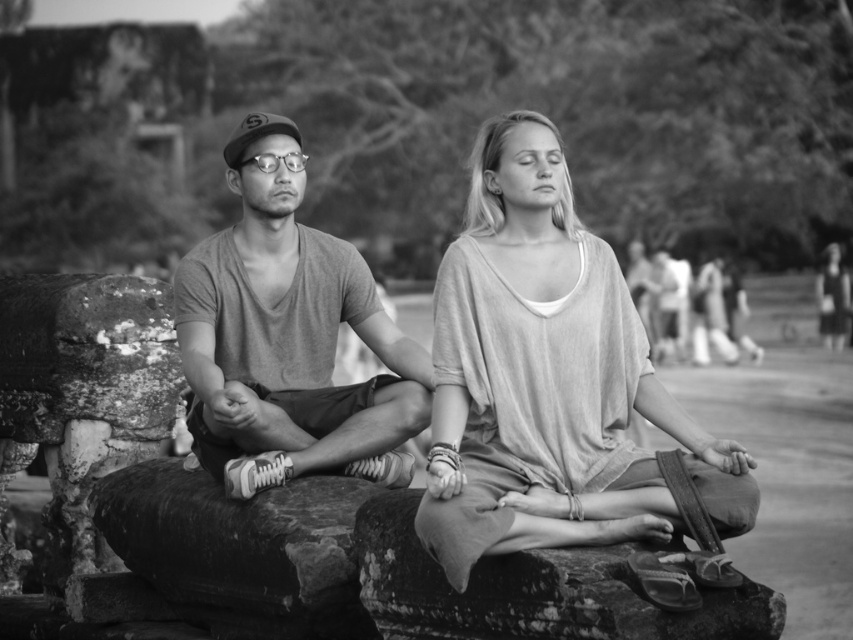
Question: Does matte gray t-shirt at left appear on the right side of smooth black dress at right?

Choices:
 (A) no
 (B) yes

Answer: (A)

Question: Which object appears closest to the camera in this image?

Choices:
 (A) matte gray shirt at center
 (B) smooth fabric dress at center
 (C) rough textured stone at center

Answer: (A)

Question: Estimate the real-world distances between objects in this image. Which object is closer to the matte gray t-shirt at left?

Choices:
 (A) smooth stone at center
 (B) rough textured stone at center
 (C) matte gray shirt at center
 (D) smooth fabric dress at center

Answer: (B)

Question: Is matte gray t-shirt at left to the right of rough textured stone at center from the viewer's perspective?

Choices:
 (A) no
 (B) yes

Answer: (B)

Question: In this image, where is matte gray t-shirt at left located relative to smooth stone at center?

Choices:
 (A) left
 (B) right

Answer: (A)

Question: Which object appears farthest from the camera in this image?

Choices:
 (A) smooth black dress at right
 (B) matte gray t-shirt at left
 (C) matte gray shirt at center
 (D) smooth stone at center

Answer: (A)